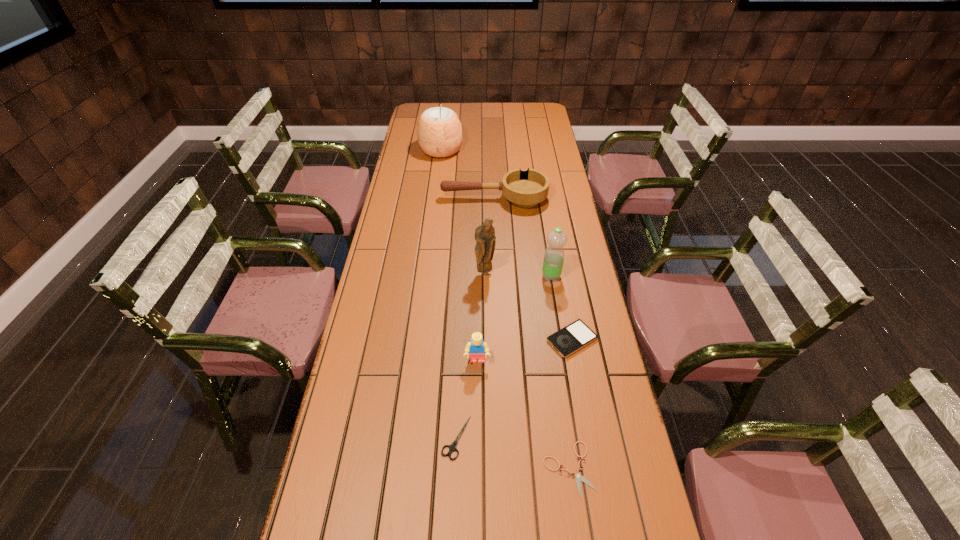
Locate an element on the screen. free spot between the shortest object and the saucepan is located at coordinates (532, 334).

You are a GUI agent. You are given a task and a screenshot of the screen. Output one action in this format:
    pyautogui.click(x=<x>, y=<y>)
    Task: Click on the empty location between the sixth tallest object and the water bottle
    
    Given the screenshot: What is the action you would take?
    pyautogui.click(x=562, y=308)

The image size is (960, 540). What are the coordinates of `vacant space in between the fourth tallest object and the seventh nearest object` in the screenshot? It's located at (486, 280).

In order to click on free area in between the sixth tallest object and the coconut in this screenshot , I will do `click(507, 245)`.

This screenshot has width=960, height=540. What are the coordinates of `free spot between the fifth shortest object and the taller shears` in the screenshot? It's located at (467, 399).

You are a GUI agent. You are given a task and a screenshot of the screen. Output one action in this format:
    pyautogui.click(x=<x>, y=<y>)
    Task: Click on the vacant space in between the fifth shortest object and the coconut
    Image resolution: width=960 pixels, height=540 pixels.
    Given the screenshot: What is the action you would take?
    pyautogui.click(x=459, y=255)

This screenshot has width=960, height=540. Find the location of `free area in between the farthest object and the shortest object`. free area in between the farthest object and the shortest object is located at coordinates (505, 310).

The height and width of the screenshot is (540, 960). I want to click on empty space between the shortest object and the left shears, so click(x=513, y=454).

The image size is (960, 540). What are the coordinates of `free space between the figurine and the farthest object` in the screenshot? It's located at (463, 212).

Identify which object is located as the sixth nearest to the right shears. Please provide its 2D coordinates. Your answer should be formatted as a tuple, i.e. [(x, y)], where the tuple contains the x and y coordinates of a point satisfying the conditions above.

[(525, 189)]